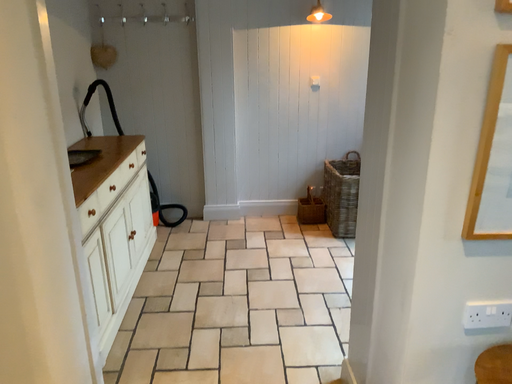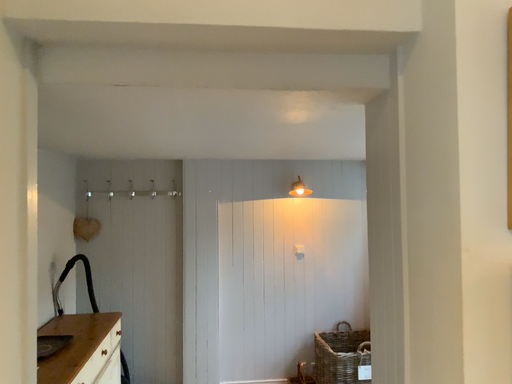
Question: Which way did the camera rotate in the video?

Choices:
 (A) rotated upward
 (B) rotated downward

Answer: (A)